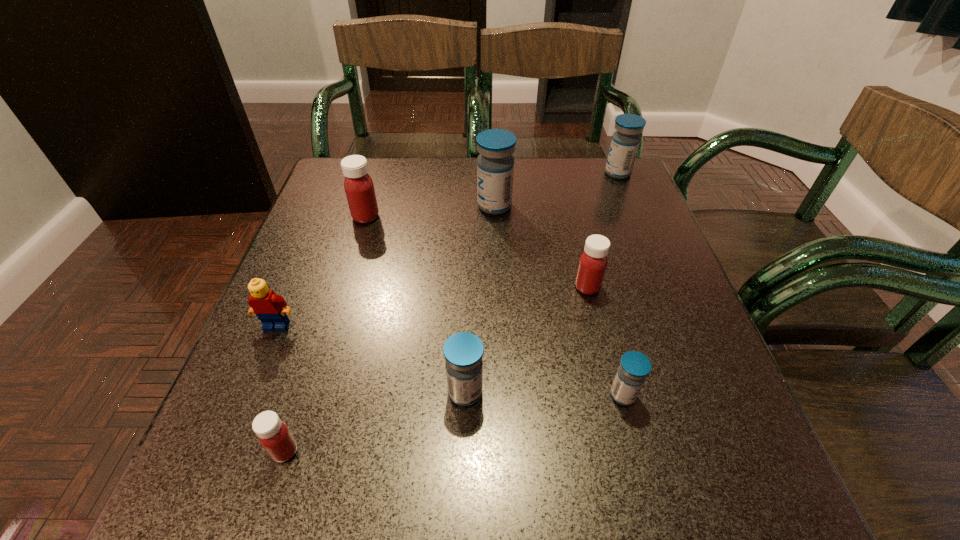
Image resolution: width=960 pixels, height=540 pixels. I want to click on free location that satisfies the following two spatial constraints: 1. on the front-facing side of the fifth farthest object; 2. on the right side of the nearest medicine, so click(225, 451).